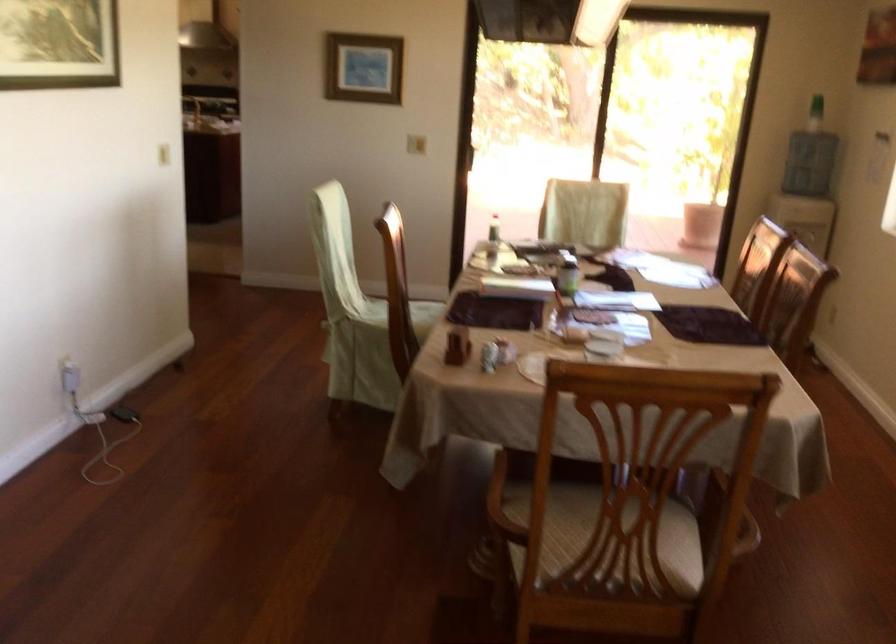
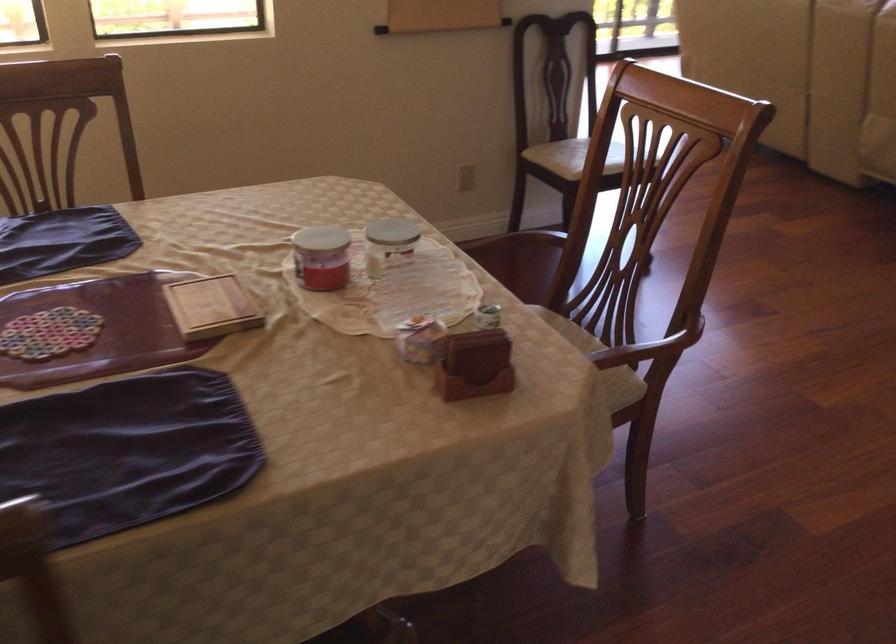
The point at (455,341) is marked in the first image. Where is the corresponding point in the second image?

(475, 365)